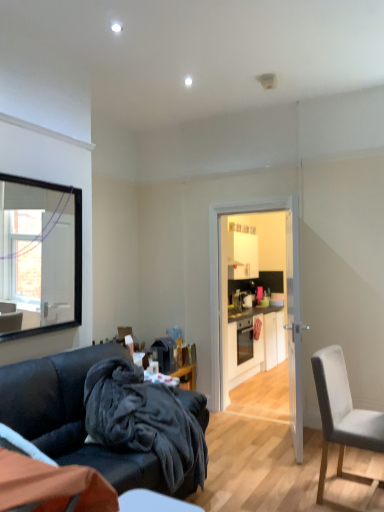
Question: In terms of height, does white glossy door at center look taller or shorter compared to light gray fabric chair at right?

Choices:
 (A) tall
 (B) short

Answer: (A)

Question: Would you say white glossy door at center is to the left or to the right of light gray fabric chair at right in the picture?

Choices:
 (A) left
 (B) right

Answer: (A)

Question: Which of these objects is positioned closest to the dark fleece blanket at lower left?

Choices:
 (A) matte black cabinets at center
 (B) velvet dark blue couch at lower left
 (C) light gray fabric chair at right
 (D) transparent glass door at center
 (E) white glossy door at center

Answer: (B)

Question: Which of these objects is positioned farthest from the velvet dark blue couch at lower left?

Choices:
 (A) white glossy door at center
 (B) matte black cabinets at center
 (C) dark fleece blanket at lower left
 (D) light gray fabric chair at right
 (E) transparent glass door at center

Answer: (B)